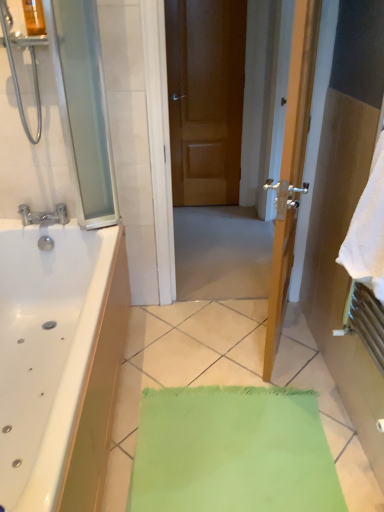
This screenshot has width=384, height=512. What are the coordinates of `transparent glass screen door at left` in the screenshot? It's located at (85, 109).

Measure the distance between point (78, 120) and camera.

Point (78, 120) is 6.07 feet away from camera.

The height and width of the screenshot is (512, 384). Describe the element at coordinates (368, 231) in the screenshot. I see `white soft towel at right` at that location.

In order to face matte silver faucet at left, should I rotate leftwards or rightwards?

Turn left approximately 19.700 degrees to face it.

This screenshot has height=512, width=384. What do you see at coordinates (43, 215) in the screenshot?
I see `matte silver faucet at left` at bounding box center [43, 215].

The height and width of the screenshot is (512, 384). Find the location of `brushed metal shower at upper left`. brushed metal shower at upper left is located at coordinates (14, 64).

Identify the location of transparent glass screen door at left. (85, 109).

Considering the sizes of matte silver faucet at left and brown wooden door at center in the image, is matte silver faucet at left taller or shorter than brown wooden door at center?

matte silver faucet at left is shorter than brown wooden door at center.

How different are the orientations of matte silver faucet at left and brown wooden door at center in degrees?

There is a 1.5-degree angle between the facing directions of matte silver faucet at left and brown wooden door at center.

Based on the photo, considering the relative sizes of matte silver faucet at left and brown wooden door at center in the image provided, is matte silver faucet at left wider than brown wooden door at center?

Indeed, matte silver faucet at left has a greater width compared to brown wooden door at center.

Between transparent glass screen door at left and matte silver faucet at left, which one has smaller size?

Smaller between the two is matte silver faucet at left.

Is transparent glass screen door at left facing away from matte silver faucet at left?

No, transparent glass screen door at left is not facing away from matte silver faucet at left.

Can you tell me how much transparent glass screen door at left and matte silver faucet at left differ in facing direction?

0.627 degrees.

Looking at their sizes, would you say transparent glass screen door at left is wider or thinner than matte silver faucet at left?

Considering their sizes, transparent glass screen door at left looks slimmer than matte silver faucet at left.

From a real-world perspective, is white soft towel at right beneath brushed metal shower at upper left?

Yes, from a real-world perspective, white soft towel at right is below brushed metal shower at upper left.

Locate an element on the screen. This screenshot has width=384, height=512. shower above the white soft towel at right (from a real-world perspective) is located at coordinates (14, 64).

Is white soft towel at right oriented towards brushed metal shower at upper left?

No.

In terms of width, does white soft towel at right look wider or thinner when compared to brushed metal shower at upper left?

In the image, white soft towel at right appears to be more narrow than brushed metal shower at upper left.

Which point is more distant from viewer, (28, 211) or (44, 7)?

The point (28, 211) is behind.

Are matte silver faucet at left and transparent glass screen door at left making contact?

No, matte silver faucet at left is not in contact with transparent glass screen door at left.

Is matte silver faucet at left bigger than transparent glass screen door at left?

No, matte silver faucet at left is not bigger than transparent glass screen door at left.

Considering the relative sizes of white soft towel at right and brown wooden door at center in the image provided, is white soft towel at right bigger than brown wooden door at center?

Incorrect, white soft towel at right is not larger than brown wooden door at center.

Considering the sizes of objects white soft towel at right and brown wooden door at center in the image provided, who is shorter, white soft towel at right or brown wooden door at center?

white soft towel at right.

Looking at this image, from the image's perspective, is white soft towel at right above or below brown wooden door at center?

Based on their image positions, white soft towel at right is located beneath brown wooden door at center.

From a real-world perspective, is white soft towel at right beneath brown wooden door at center?

No, from a real-world perspective, white soft towel at right is not under brown wooden door at center.

Does transparent glass screen door at left have a greater width compared to brown wooden door at center?

Correct, the width of transparent glass screen door at left exceeds that of brown wooden door at center.

Would you say transparent glass screen door at left is outside brown wooden door at center?

Yes, transparent glass screen door at left is outside of brown wooden door at center.

How different are the orientations of brushed metal shower at upper left and brown wooden door at center in degrees?

There is a 1.7-degree angle between the facing directions of brushed metal shower at upper left and brown wooden door at center.

Are brushed metal shower at upper left and brown wooden door at center beside each other?

brushed metal shower at upper left is not next to brown wooden door at center, and they're not touching.

Based on the photo, considering the sizes of objects brushed metal shower at upper left and brown wooden door at center in the image provided, who is smaller, brushed metal shower at upper left or brown wooden door at center?

Smaller between the two is brushed metal shower at upper left.

Consider the image. Is brushed metal shower at upper left outside of brown wooden door at center?

Yes, brushed metal shower at upper left is not within brown wooden door at center.

This screenshot has width=384, height=512. I want to click on door on the right of matte silver faucet at left, so click(206, 98).

Identify the location of screen door lying above the matte silver faucet at left (from the image's perspective). (85, 109).

Estimate the real-world distances between objects in this image. Which object is closer to brushed metal shower at upper left, matte silver faucet at left or white soft towel at right?

matte silver faucet at left is closer to brushed metal shower at upper left.

From the image, which object appears to be nearer to matte silver faucet at left, brushed metal shower at upper left or brown wooden door at center?

brushed metal shower at upper left is positioned closer to the anchor matte silver faucet at left.

Consider the image. Looking at the image, which one is located closer to white soft towel at right, transparent glass screen door at left or brushed metal shower at upper left?

transparent glass screen door at left is closer to white soft towel at right.

Estimate the real-world distances between objects in this image. Which object is further from transparent glass screen door at left, brown wooden door at center or matte silver faucet at left?

brown wooden door at center lies further to transparent glass screen door at left than the other object.

Which object lies nearer to the anchor point matte silver faucet at left, transparent glass screen door at left or brown wooden door at center?

Based on the image, transparent glass screen door at left appears to be nearer to matte silver faucet at left.

Looking at this image, from the image, which object appears to be nearer to brushed metal shower at upper left, white soft towel at right or brown wooden door at center?

The object closer to brushed metal shower at upper left is white soft towel at right.

Based on their spatial positions, is transparent glass screen door at left or white soft towel at right further from matte silver faucet at left?

The object further to matte silver faucet at left is white soft towel at right.

Which object lies nearer to the anchor point transparent glass screen door at left, white soft towel at right or brown wooden door at center?

white soft towel at right is closer to transparent glass screen door at left.

Locate an element on the screen. screen door between matte silver faucet at left and white soft towel at right is located at coordinates (85, 109).

Where is `screen door that lies between brushed metal shower at upper left and matte silver faucet at left from top to bottom`? The image size is (384, 512). screen door that lies between brushed metal shower at upper left and matte silver faucet at left from top to bottom is located at coordinates (85, 109).

The image size is (384, 512). I want to click on tap positioned between transparent glass screen door at left and brown wooden door at center from near to far, so click(x=43, y=215).

Where is `shower between white soft towel at right and brown wooden door at center along the z-axis`? shower between white soft towel at right and brown wooden door at center along the z-axis is located at coordinates (14, 64).